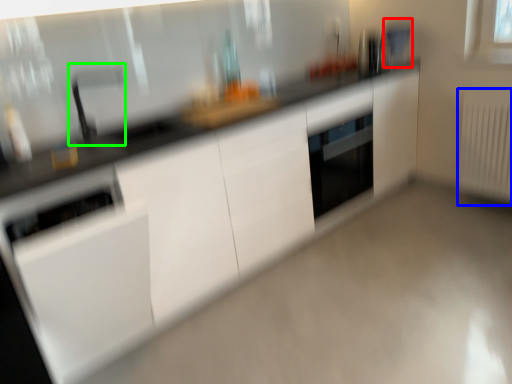
Question: Considering the real-world distances, which object is closest to appliance (highlighted by a red box)? radiator (highlighted by a blue box) or faucet (highlighted by a green box).

Choices:
 (A) radiator
 (B) faucet

Answer: (A)